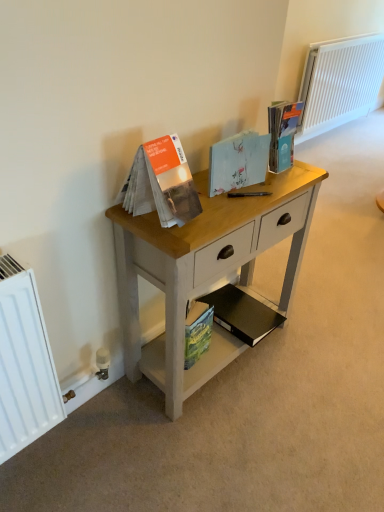
Question: Can you confirm if light wood desk at center is shorter than white painted radiator at upper right?

Choices:
 (A) yes
 (B) no

Answer: (A)

Question: Is light wood desk at center at the right side of white painted radiator at upper right?

Choices:
 (A) yes
 (B) no

Answer: (B)

Question: Does light wood desk at center have a larger size compared to white painted radiator at upper right?

Choices:
 (A) no
 (B) yes

Answer: (A)

Question: Can you confirm if light wood desk at center is thinner than white painted radiator at upper right?

Choices:
 (A) yes
 (B) no

Answer: (B)

Question: Does light wood desk at center come behind white painted radiator at upper right?

Choices:
 (A) yes
 (B) no

Answer: (B)

Question: From a real-world perspective, is matte blue paperback book at upper right, the 4th paperback book when ordered from bottom to top, above or below light wood desk at center?

Choices:
 (A) above
 (B) below

Answer: (A)

Question: Based on their positions, is matte blue paperback book at upper right, the 4th paperback book when ordered from bottom to top, located to the left or right of light wood desk at center?

Choices:
 (A) left
 (B) right

Answer: (B)

Question: Is matte blue paperback book at upper right, the 1th paperback book viewed from the top, inside or outside of light wood desk at center?

Choices:
 (A) outside
 (B) inside

Answer: (A)

Question: Relative to light wood desk at center, is matte blue paperback book at upper right, the 4th paperback book when ordered from bottom to top, in front or behind?

Choices:
 (A) behind
 (B) front

Answer: (A)

Question: In the image, is green matte paperback book at lower center, which appears as the 1th paperback book when ordered from the bottom, positioned in front of or behind white painted radiator at upper right?

Choices:
 (A) front
 (B) behind

Answer: (A)

Question: Is green matte paperback book at lower center, which appears as the 4th paperback book when viewed from the top, spatially inside white painted radiator at upper right, or outside of it?

Choices:
 (A) inside
 (B) outside

Answer: (B)

Question: Is point (192, 359) positioned closer to the camera than point (367, 41)?

Choices:
 (A) farther
 (B) closer

Answer: (B)

Question: In terms of width, does green matte paperback book at lower center, which appears as the 1th paperback book when ordered from the bottom, look wider or thinner when compared to white painted radiator at upper right?

Choices:
 (A) thin
 (B) wide

Answer: (A)

Question: In terms of size, does white painted radiator at upper right appear bigger or smaller than light wood desk at center?

Choices:
 (A) small
 (B) big

Answer: (B)

Question: From a real-world perspective, is white painted radiator at upper right positioned above or below light wood desk at center?

Choices:
 (A) below
 (B) above

Answer: (B)